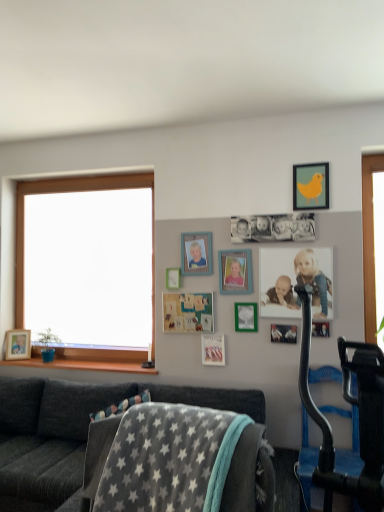
Question: Considering the relative positions of matte white picture frame at center, which is the 2th picture frame from back to front, and metallic silver photo frame at center, the eighth picture frame in the back-to-front sequence, in the image provided, is matte white picture frame at center, which is the 2th picture frame from back to front, to the right of metallic silver photo frame at center, the eighth picture frame in the back-to-front sequence, from the viewer's perspective?

Choices:
 (A) no
 (B) yes

Answer: (A)

Question: Is matte white picture frame at center, the 2th picture frame viewed from the left, taller than metallic silver photo frame at center, the eighth picture frame in the back-to-front sequence?

Choices:
 (A) yes
 (B) no

Answer: (A)

Question: Is matte white picture frame at center, marked as the tenth picture frame in a right-to-left arrangement, at the left side of metallic silver photo frame at center, which is the 4th picture frame from front to back?

Choices:
 (A) no
 (B) yes

Answer: (B)

Question: Can you confirm if matte white picture frame at center, the tenth picture frame when ordered from front to back, is wider than metallic silver photo frame at center, the eighth picture frame in the back-to-front sequence?

Choices:
 (A) yes
 (B) no

Answer: (A)

Question: Does matte white picture frame at center, which is the 2th picture frame from back to front, have a lesser width compared to metallic silver photo frame at center, the eighth picture frame in the back-to-front sequence?

Choices:
 (A) yes
 (B) no

Answer: (B)

Question: Is black plastic exercise machine at right inside or outside of matte yellow bird at upper right, which ranks as the 3th picture frame in front-to-back order?

Choices:
 (A) inside
 (B) outside

Answer: (B)

Question: From the image's perspective, relative to matte yellow bird at upper right, the 10th picture frame positioned from the left, is black plastic exercise machine at right above or below?

Choices:
 (A) below
 (B) above

Answer: (A)

Question: Does point (326, 488) appear closer or farther from the camera than point (304, 200)?

Choices:
 (A) closer
 (B) farther

Answer: (A)

Question: From a real-world perspective, relative to matte yellow bird at upper right, which is the ninth picture frame in back-to-front order, is black plastic exercise machine at right vertically above or below?

Choices:
 (A) below
 (B) above

Answer: (A)

Question: Would you say green matte picture frame at upper center, the seventh picture frame when ordered from left to right, is to the left or to the right of matte white picture frame at center, the tenth picture frame when ordered from front to back, in the picture?

Choices:
 (A) left
 (B) right

Answer: (B)

Question: Is green matte picture frame at upper center, the 5th picture frame from the right, inside the boundaries of matte white picture frame at center, marked as the tenth picture frame in a right-to-left arrangement, or outside?

Choices:
 (A) outside
 (B) inside

Answer: (A)

Question: Is green matte picture frame at upper center, the seventh picture frame when ordered from left to right, bigger or smaller than matte white picture frame at center, which is the 2th picture frame from back to front?

Choices:
 (A) big
 (B) small

Answer: (A)

Question: Considering the positions of green matte picture frame at upper center, the 5th picture frame from the right, and matte white picture frame at center, which is the 2th picture frame from back to front, in the image, is green matte picture frame at upper center, the 5th picture frame from the right, wider or thinner than matte white picture frame at center, which is the 2th picture frame from back to front,?

Choices:
 (A) wide
 (B) thin

Answer: (B)

Question: Is wooden picture frame at upper center, which is the 10th picture frame from back to front, bigger or smaller than wooden at left?

Choices:
 (A) big
 (B) small

Answer: (B)

Question: Considering the positions of point (324, 330) and point (84, 362), is point (324, 330) closer or farther from the camera than point (84, 362)?

Choices:
 (A) farther
 (B) closer

Answer: (B)